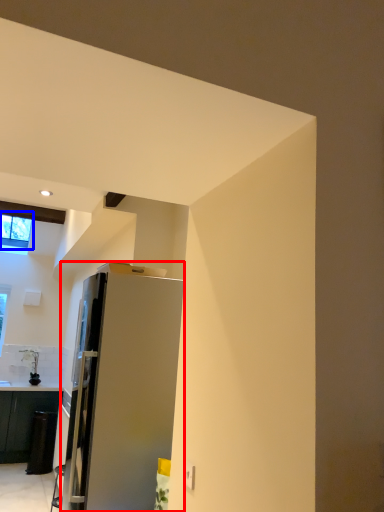
Question: Which object is closer to the camera taking this photo, refrigerator (highlighted by a red box) or window (highlighted by a blue box)?

Choices:
 (A) refrigerator
 (B) window

Answer: (A)